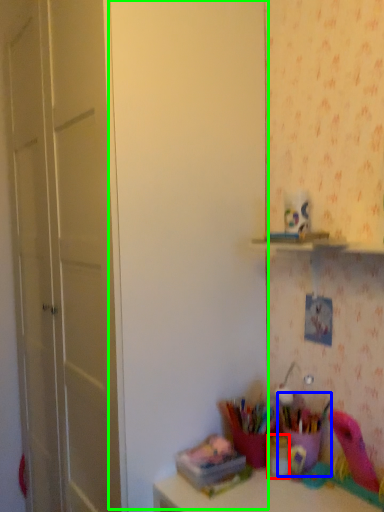
Question: Estimate the real-world distances between objects in this image. Which object is closer to stationery (highlighted by a red box), stationery (highlighted by a blue box) or door (highlighted by a green box)?

Choices:
 (A) stationery
 (B) door

Answer: (A)